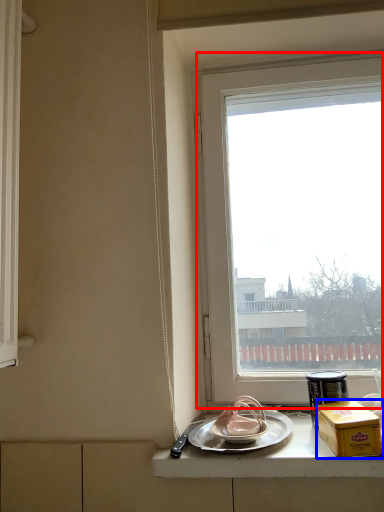
Question: Which object is further to the camera taking this photo, window (highlighted by a red box) or box (highlighted by a blue box)?

Choices:
 (A) window
 (B) box

Answer: (A)